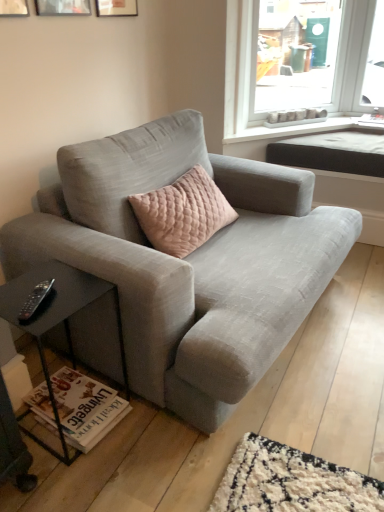
Question: Which is correct: black plastic remote at lower left is inside textured gray couch at center, or outside of it?

Choices:
 (A) inside
 (B) outside

Answer: (B)

Question: From the image's perspective, is black plastic remote at lower left positioned above or below textured gray couch at center?

Choices:
 (A) below
 (B) above

Answer: (A)

Question: Which object is positioned farthest from the metallic silver picture frame at upper left, placed as the 2th picture frame when sorted from right to left?

Choices:
 (A) textured gray couch at center
 (B) black plastic remote at lower left
 (C) wooden picture frame at upper left, placed as the first picture frame when sorted from left to right
 (D) matte wooden picture frame at upper center, the first picture frame viewed from the right
 (E) black matte side table at lower left

Answer: (B)

Question: Which of these objects is positioned closest to the wooden picture frame at upper left, placed as the first picture frame when sorted from left to right?

Choices:
 (A) metallic silver picture frame at upper left, which is the 2th picture frame from left to right
 (B) textured gray couch at center
 (C) matte wooden picture frame at upper center, the first picture frame viewed from the right
 (D) black plastic remote at lower left
 (E) black matte side table at lower left

Answer: (A)